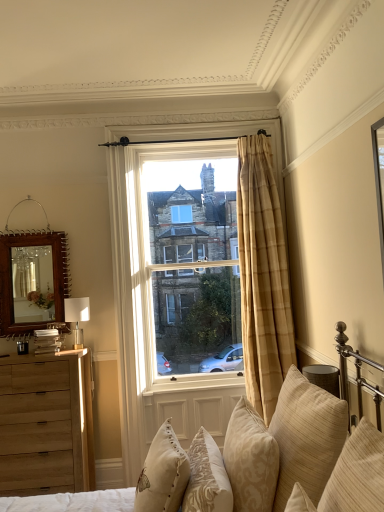
Question: Is plaid curtain at center, which appears as the 1th window when viewed from the front, inside or outside of white fabric lampshade at left?

Choices:
 (A) outside
 (B) inside

Answer: (A)

Question: From their relative heights in the image, would you say plaid curtain at center, which appears as the 1th window when viewed from the front, is taller or shorter than white fabric lampshade at left?

Choices:
 (A) short
 (B) tall

Answer: (B)

Question: Which object is the closest to the natural wood dresser at left?

Choices:
 (A) white fabric lampshade at left
 (B) velvet beige pillow at lower center, which is the 4th pillow from right to left
 (C) beige striped pillow at lower right, the 1th pillow positioned from the right
 (D) beige textured pillow at lower right, the second pillow positioned from the right
 (E) plaid curtain at center, which appears as the 1th window when viewed from the front

Answer: (A)

Question: Estimate the real-world distances between objects in this image. Which object is closer to the plaid curtain at center, the second window in the back-to-front sequence?

Choices:
 (A) beige damask pillow at lower center, arranged as the third pillow when viewed from the right
 (B) plaid fabric curtain at center
 (C) wooden mirror at left
 (D) beige embroidered pillow at lower center, which appears as the 5th pillow when viewed from the right
 (E) clear glass window at center, positioned as the second window in front-to-back order

Answer: (E)